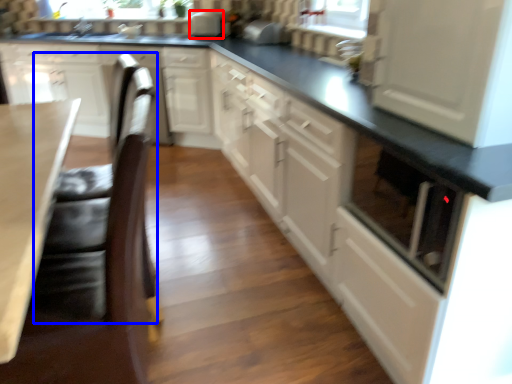
Question: Which object is closer to the camera taking this photo, appliance (highlighted by a red box) or swivel chair (highlighted by a blue box)?

Choices:
 (A) appliance
 (B) swivel chair

Answer: (B)